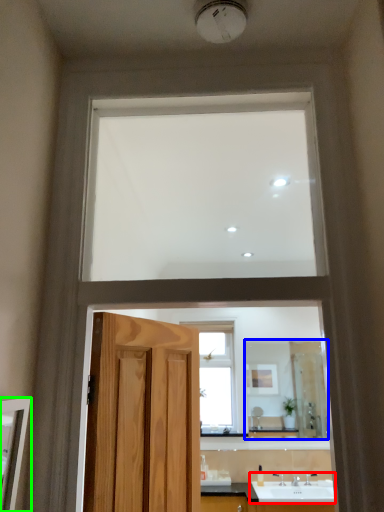
Question: Considering the real-world distances, which object is farthest from sink (highlighted by a red box)? mirror (highlighted by a blue box) or mirror (highlighted by a green box)?

Choices:
 (A) mirror
 (B) mirror

Answer: (B)